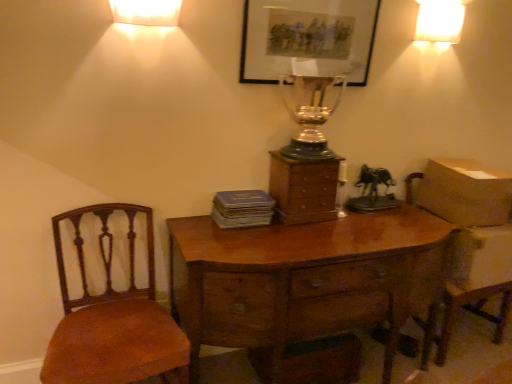
Question: Is brown cardboard box at right positioned behind matte gray book at center?

Choices:
 (A) yes
 (B) no

Answer: (A)

Question: Does brown cardboard box at right have a lesser height compared to matte gray book at center?

Choices:
 (A) yes
 (B) no

Answer: (B)

Question: Is brown cardboard box at right not near matte gray book at center?

Choices:
 (A) no
 (B) yes

Answer: (B)

Question: Is brown cardboard box at right oriented away from matte gray book at center?

Choices:
 (A) yes
 (B) no

Answer: (B)

Question: Can you confirm if brown cardboard box at right is thinner than matte gray book at center?

Choices:
 (A) yes
 (B) no

Answer: (B)

Question: Is brown cardboard box at right outside matte gray book at center?

Choices:
 (A) yes
 (B) no

Answer: (A)

Question: Does white glossy lampshade at upper right, the first lamp viewed from the back, have a lesser height compared to wooden chest of drawers at center?

Choices:
 (A) no
 (B) yes

Answer: (B)

Question: Considering the relative sizes of white glossy lampshade at upper right, the first lamp viewed from the back, and wooden chest of drawers at center in the image provided, is white glossy lampshade at upper right, the first lamp viewed from the back, taller than wooden chest of drawers at center?

Choices:
 (A) yes
 (B) no

Answer: (B)

Question: Does white glossy lampshade at upper right, acting as the 2th lamp starting from the bottom, have a larger size compared to wooden chest of drawers at center?

Choices:
 (A) no
 (B) yes

Answer: (A)

Question: Would you say white glossy lampshade at upper right, marked as the first lamp in a top-to-bottom arrangement, is outside wooden chest of drawers at center?

Choices:
 (A) no
 (B) yes

Answer: (B)

Question: Is white glossy lampshade at upper right, acting as the 2th lamp starting from the bottom, oriented away from wooden chest of drawers at center?

Choices:
 (A) no
 (B) yes

Answer: (A)

Question: Is the depth of white glossy lampshade at upper right, the first lamp viewed from the back, greater than that of wooden chest of drawers at center?

Choices:
 (A) yes
 (B) no

Answer: (A)

Question: Does white glossy lampshade at upper right, acting as the 2th lamp starting from the bottom, have a greater width compared to wooden armchair at right?

Choices:
 (A) yes
 (B) no

Answer: (B)